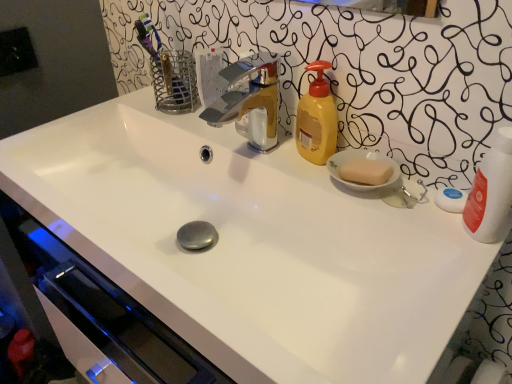
Where is `vacant space situated on the left part of white glossy bottle at right`? This screenshot has width=512, height=384. vacant space situated on the left part of white glossy bottle at right is located at coordinates (401, 214).